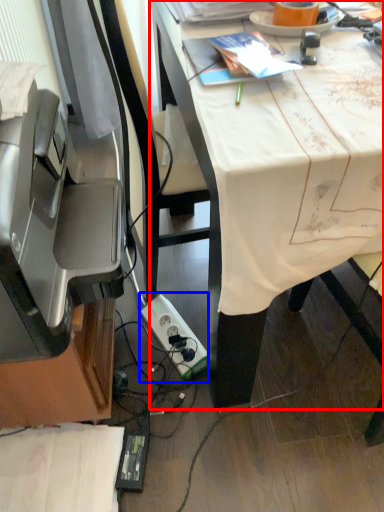
Question: Which point is further to the camera, desk (highlighted by a red box) or power plugs and sockets (highlighted by a blue box)?

Choices:
 (A) desk
 (B) power plugs and sockets

Answer: (B)